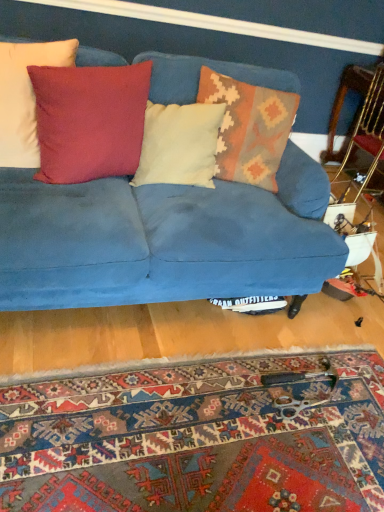
Question: Does suede-like red pillow at upper left, the second pillow in the left-to-right sequence, have a lesser height compared to wooden armchair at right?

Choices:
 (A) yes
 (B) no

Answer: (A)

Question: Is suede-like red pillow at upper left, placed as the third pillow when sorted from right to left, outside of wooden armchair at right?

Choices:
 (A) yes
 (B) no

Answer: (A)

Question: Considering the relative positions of suede-like red pillow at upper left, the second pillow in the left-to-right sequence, and wooden armchair at right in the image provided, is suede-like red pillow at upper left, the second pillow in the left-to-right sequence, in front of wooden armchair at right?

Choices:
 (A) no
 (B) yes

Answer: (B)

Question: From a real-world perspective, is suede-like red pillow at upper left, the second pillow in the left-to-right sequence, positioned over wooden armchair at right based on gravity?

Choices:
 (A) no
 (B) yes

Answer: (B)

Question: From the image's perspective, is suede-like red pillow at upper left, the second pillow in the left-to-right sequence, on top of wooden armchair at right?

Choices:
 (A) yes
 (B) no

Answer: (B)

Question: From the image's perspective, is carpet with intricate patterns at lower center located above or below matte red pillow at upper left, positioned as the fourth pillow in right-to-left order?

Choices:
 (A) below
 (B) above

Answer: (A)

Question: Considering the positions of carpet with intricate patterns at lower center and matte red pillow at upper left, positioned as the fourth pillow in right-to-left order, in the image, is carpet with intricate patterns at lower center wider or thinner than matte red pillow at upper left, positioned as the fourth pillow in right-to-left order,?

Choices:
 (A) wide
 (B) thin

Answer: (A)

Question: From a real-world perspective, relative to matte red pillow at upper left, which is counted as the first pillow, starting from the left, is carpet with intricate patterns at lower center vertically above or below?

Choices:
 (A) below
 (B) above

Answer: (A)

Question: Is carpet with intricate patterns at lower center situated inside matte red pillow at upper left, which is counted as the first pillow, starting from the left, or outside?

Choices:
 (A) inside
 (B) outside

Answer: (B)

Question: Is light blue suede pillow at center, which is the 3th pillow in left-to-right order, wider or thinner than matte red pillow at upper left, positioned as the fourth pillow in right-to-left order?

Choices:
 (A) thin
 (B) wide

Answer: (B)

Question: From a real-world perspective, is light blue suede pillow at center, the second pillow viewed from the right, physically located above or below matte red pillow at upper left, which is counted as the first pillow, starting from the left?

Choices:
 (A) below
 (B) above

Answer: (A)

Question: Would you say light blue suede pillow at center, which is the 3th pillow in left-to-right order, is to the left or to the right of matte red pillow at upper left, which is counted as the first pillow, starting from the left, in the picture?

Choices:
 (A) left
 (B) right

Answer: (B)

Question: Choose the correct answer: Is light blue suede pillow at center, the second pillow viewed from the right, inside matte red pillow at upper left, positioned as the fourth pillow in right-to-left order, or outside it?

Choices:
 (A) outside
 (B) inside

Answer: (A)

Question: From their relative heights in the image, would you say velvet blue couch at center is taller or shorter than suede-like red pillow at upper left, the second pillow in the left-to-right sequence?

Choices:
 (A) short
 (B) tall

Answer: (B)

Question: Visually, is velvet blue couch at center positioned to the left or to the right of suede-like red pillow at upper left, placed as the third pillow when sorted from right to left?

Choices:
 (A) right
 (B) left

Answer: (A)